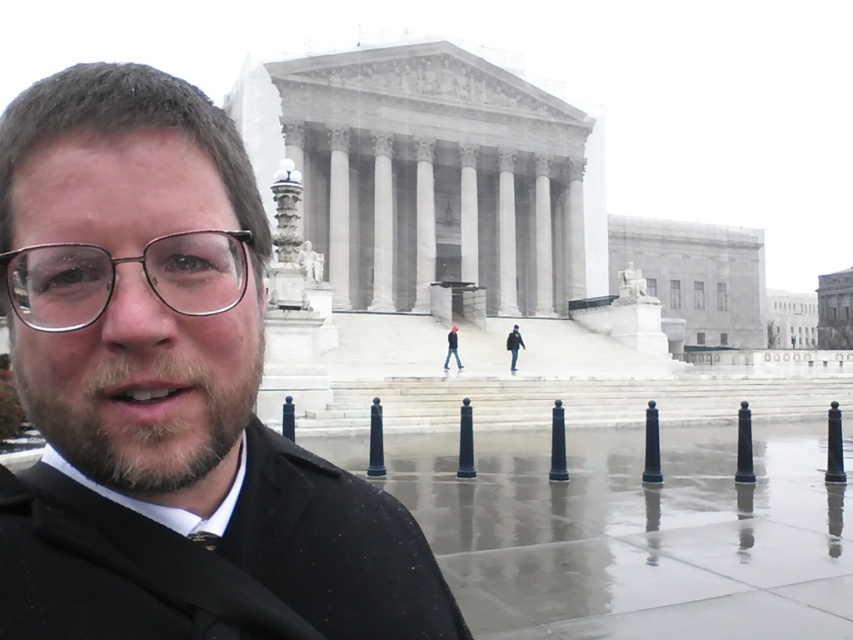
You are a photographer trying to capture a portrait of the person in the center. Given that your camera has a limited focus range, which object should you focus on to ensure both the black matte coat at center and the brown fuzzy beard at center are in focus? Explain your reasoning.

The black matte coat at center is bigger than the brown fuzzy beard at center. To ensure both are in focus, you should focus on the black matte coat at center since it is larger and requires more precise focus to capture details.

You are a photographer trying to capture the person in the scene. If you focus on the brown fuzzy beard at center, will the black matte coat at center also be in focus in the same photo?

The black matte coat at center is positioned over brown fuzzy beard at center, so yes, the black matte coat at center will also be in focus if the brown fuzzy beard at center is in focus.